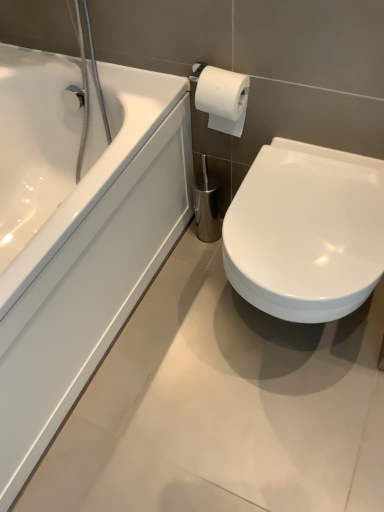
The image size is (384, 512). Identify the location of vacant area that is in front of white glossy toilet at lower right. (291, 432).